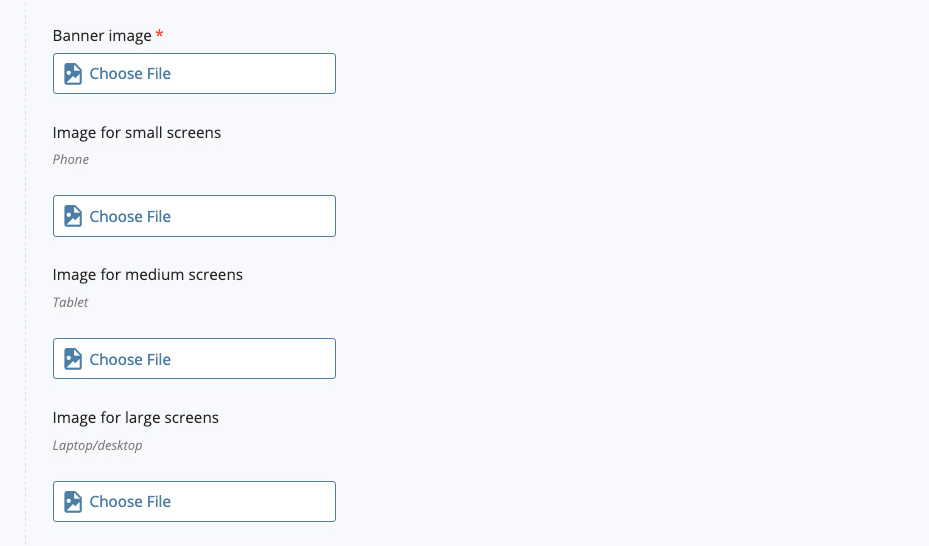
Locate an element on the screen. laptop/desktop is located at coordinates (90, 446).